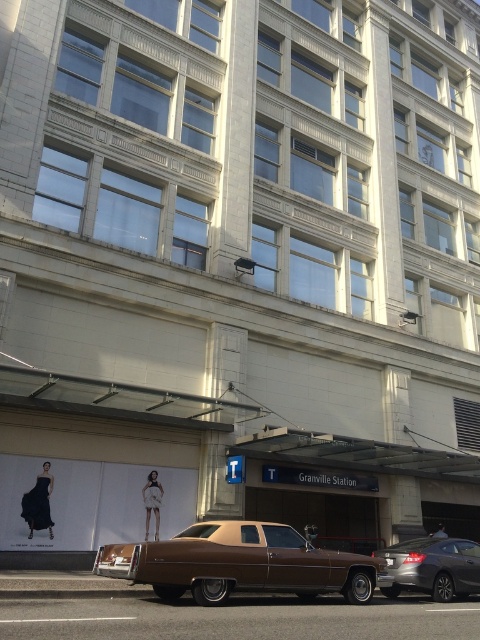
Question: Which point appears closest to the camera in this image?

Choices:
 (A) (104, 556)
 (B) (389, 589)

Answer: (A)

Question: Can you confirm if brown matte sedan at center is thinner than silver metallic sedan at lower right?

Choices:
 (A) no
 (B) yes

Answer: (A)

Question: Does brown matte sedan at center have a larger size compared to silver metallic sedan at lower right?

Choices:
 (A) no
 (B) yes

Answer: (B)

Question: Which point is farther to the camera?

Choices:
 (A) (428, 576)
 (B) (168, 561)

Answer: (A)

Question: Is brown matte sedan at center to the left of silver metallic sedan at lower right from the viewer's perspective?

Choices:
 (A) no
 (B) yes

Answer: (B)

Question: Which object appears closest to the camera in this image?

Choices:
 (A) brown matte sedan at center
 (B) silver metallic sedan at lower right

Answer: (A)